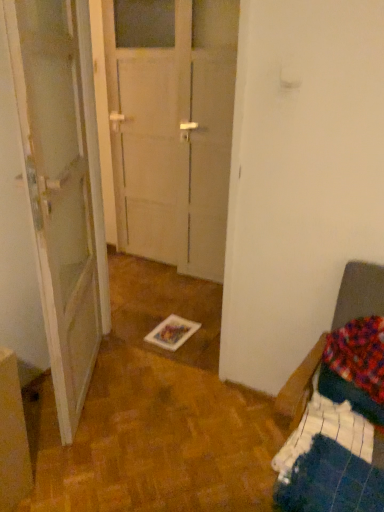
This screenshot has height=512, width=384. I want to click on unoccupied region to the right of white glossy door at left, so click(167, 400).